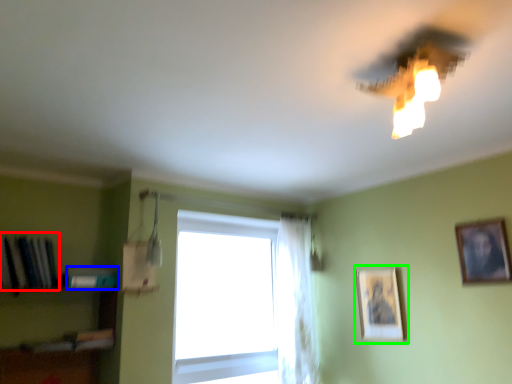
Question: Estimate the real-world distances between objects in this image. Which object is farther from book (highlighted by a red box), book (highlighted by a blue box) or picture frame (highlighted by a green box)?

Choices:
 (A) book
 (B) picture frame

Answer: (B)